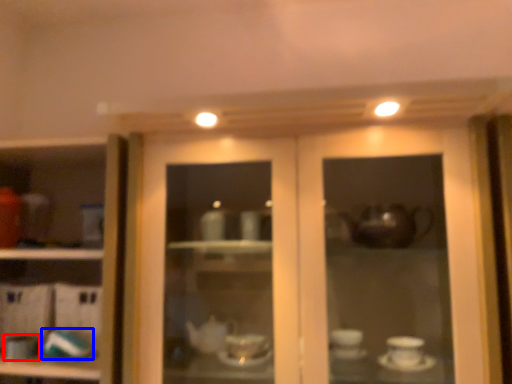
Question: Which point is closer to the camera, tableware (highlighted by a red box) or tableware (highlighted by a blue box)?

Choices:
 (A) tableware
 (B) tableware

Answer: (A)